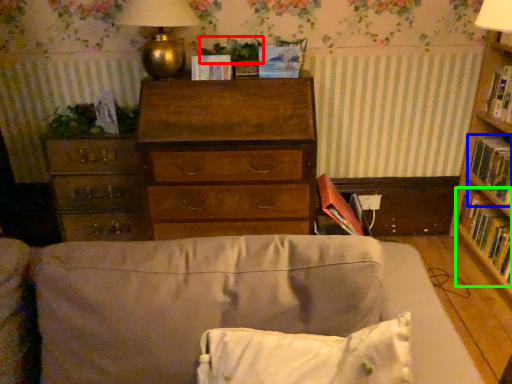
Question: Considering the real-world distances, which object is closest to plant (highlighted by a red box)? paperback book (highlighted by a blue box) or book (highlighted by a green box).

Choices:
 (A) paperback book
 (B) book

Answer: (A)